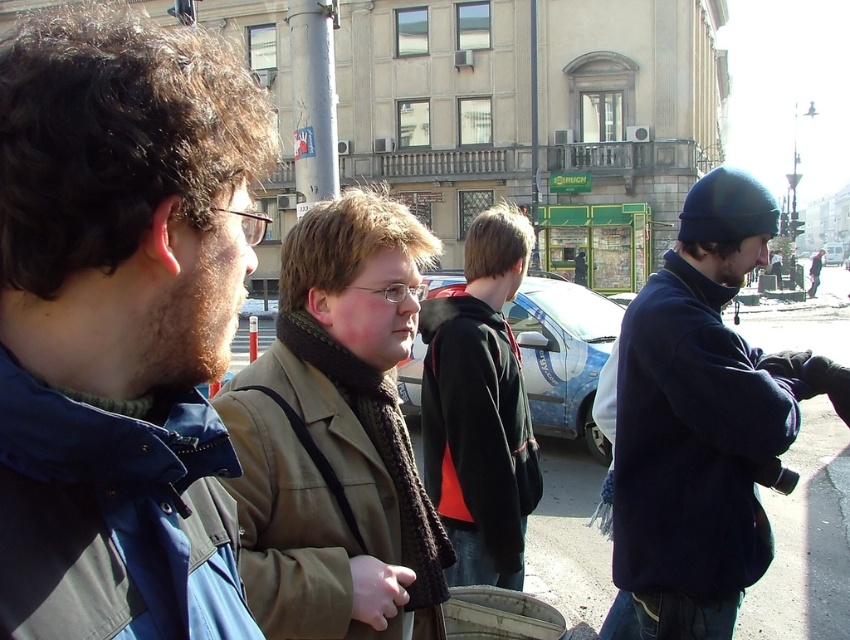
Who is shorter, khaki fabric jacket at center or dark blue fleece jacket at right?

With less height is khaki fabric jacket at center.

Does khaki fabric jacket at center come in front of dark blue fleece jacket at right?

Yes, khaki fabric jacket at center is closer to the viewer.

The height and width of the screenshot is (640, 850). I want to click on khaki fabric jacket at center, so click(x=338, y=436).

Is khaki fabric jacket at center bigger than dark green hoodie at center?

No.

Does khaki fabric jacket at center have a greater width compared to dark green hoodie at center?

No.

Find the location of a particular element. khaki fabric jacket at center is located at coordinates (338, 436).

I want to click on khaki fabric jacket at center, so click(x=338, y=436).

Is point (162, 483) farther from camera compared to point (714, 420)?

No.

Who is more distant from viewer, (98, 214) or (738, 592)?

Positioned behind is point (738, 592).

Find the location of `blue fabric jacket at left`. blue fabric jacket at left is located at coordinates (119, 321).